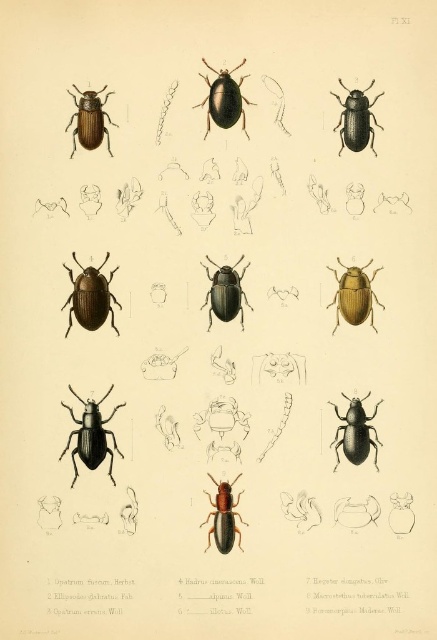
You are a researcher examining Plate XI from a natural history book. You need to locate the black matte beetle at lower left for your study. According to the coordinates provided, where exactly should you look on the plate?

The black matte beetle at lower left is located at point (90, 435) on the plate.

You are an entomologist examining the beetles in the illustration. You need to identify which beetle is bigger between the black matte beetle at lower left and the shiny brown beetle at upper left. Which one is larger?

The black matte beetle at lower left is larger in size than the shiny brown beetle at upper left.